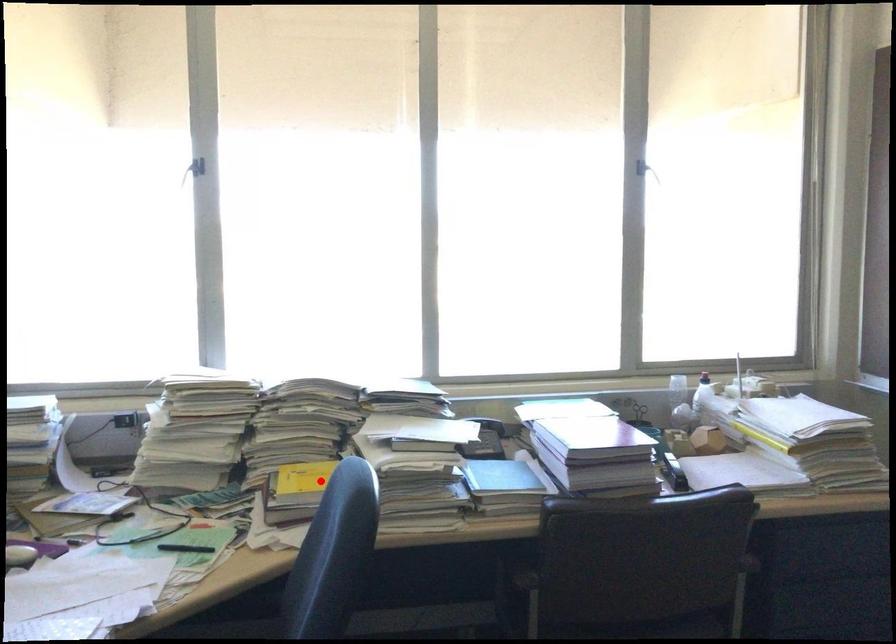
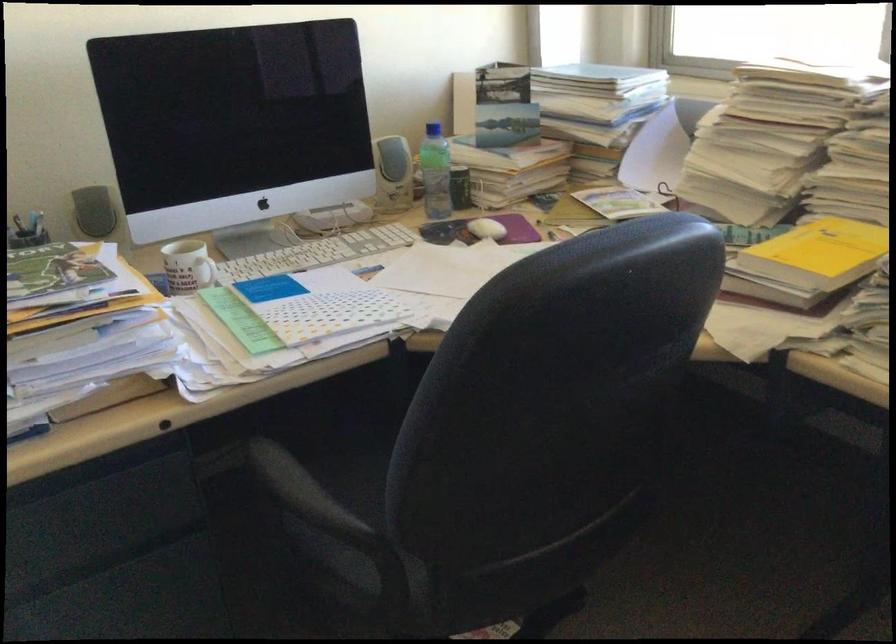
Question: A red point is marked in image1. In image2, is the corresponding 3D point closer to the camera or farther? Reply with the corresponding letter.

Choices:
 (A) The corresponding 3D point is closer.
 (B) The corresponding 3D point is farther.

Answer: (A)